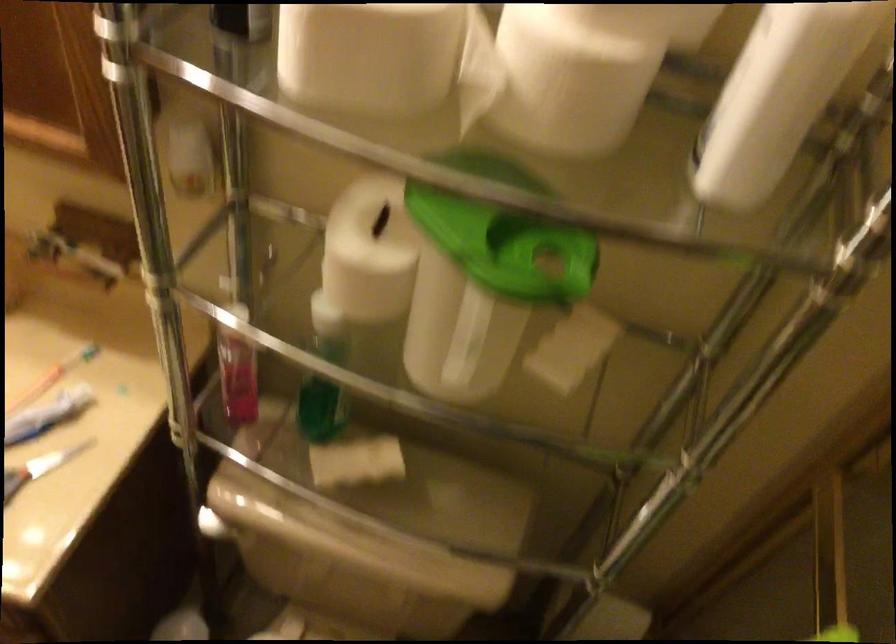
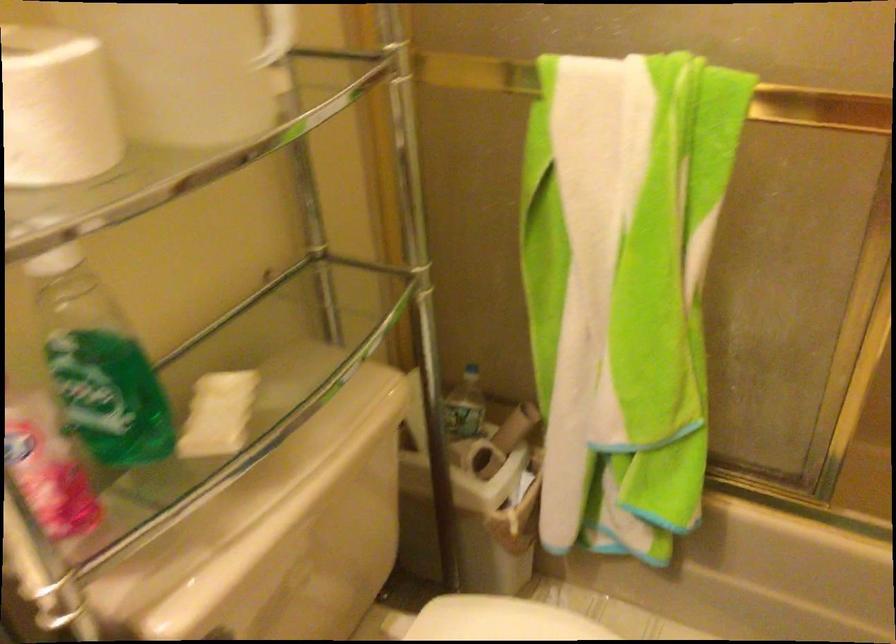
The images are taken continuously from a first-person perspective. In which direction is your viewpoint rotating?

The camera rotated toward right-down.